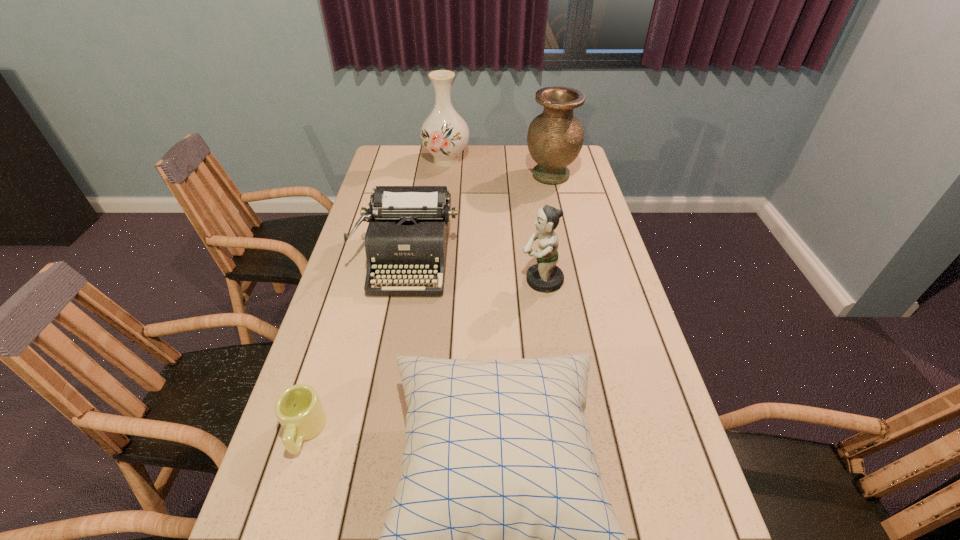
Find the location of a particular element. the left vase is located at coordinates (444, 133).

Find the location of a particular element. Image resolution: width=960 pixels, height=540 pixels. the right vase is located at coordinates (555, 137).

What are the coordinates of `figurine` in the screenshot? It's located at (545, 276).

Identify the location of typewriter. (407, 235).

Find the location of a particular element. The height and width of the screenshot is (540, 960). the shortest object is located at coordinates (298, 408).

I want to click on free spot located 0.160m on the front of the left vase, so click(x=443, y=194).

At what (x,y) coordinates should I click in order to perform the action: click on free region located on the front of the right vase. Please return your answer as a coordinate pair (x, y). Image resolution: width=960 pixels, height=540 pixels. Looking at the image, I should click on (564, 234).

Find the location of a particular element. The width and height of the screenshot is (960, 540). free region located 0.250m on the front-facing side of the figurine is located at coordinates (437, 280).

The width and height of the screenshot is (960, 540). I want to click on vacant space located on the front-facing side of the figurine, so click(503, 280).

Where is `vacant position located 0.050m on the front-facing side of the figurine`? The width and height of the screenshot is (960, 540). vacant position located 0.050m on the front-facing side of the figurine is located at coordinates (503, 280).